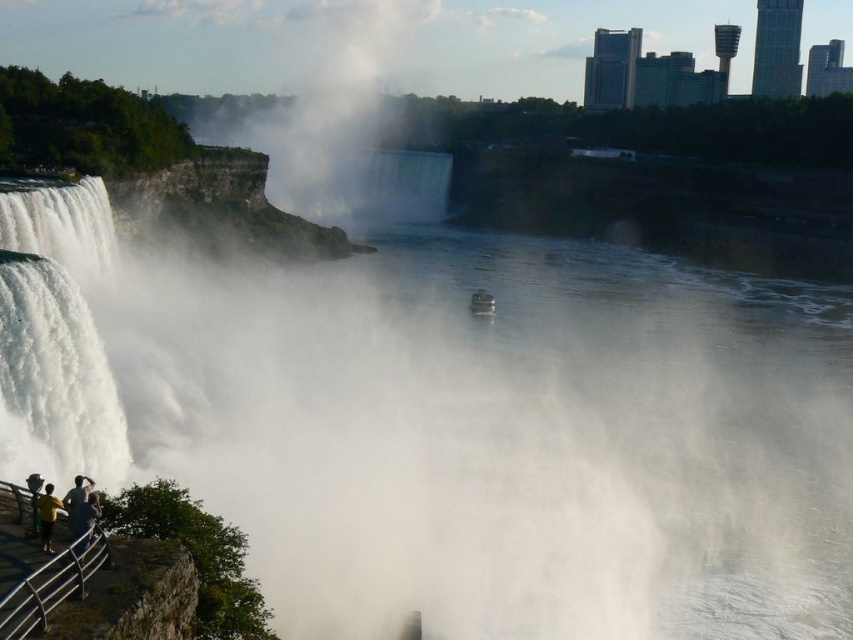
Question: Considering the real-world distances, which object is closest to the white frothy water at left?

Choices:
 (A) yellow t-shirt at lower left
 (B) metallic gray boat at center

Answer: (A)

Question: Which of the following is the farthest from the observer?

Choices:
 (A) (637, 371)
 (B) (111, 419)
 (C) (42, 531)

Answer: (A)

Question: From the image, what is the correct spatial relationship of white misty water at left in relation to yellow t-shirt at lower left?

Choices:
 (A) above
 (B) below

Answer: (A)

Question: Where is white frothy water at left located in relation to yellow t-shirt at lower left in the image?

Choices:
 (A) right
 (B) left

Answer: (B)

Question: Which of the following is the farthest from the observer?

Choices:
 (A) (50, 500)
 (B) (59, 371)
 (C) (486, 310)
 (D) (364, 556)

Answer: (C)

Question: Is white misty water at left in front of metallic gray boat at center?

Choices:
 (A) no
 (B) yes

Answer: (B)